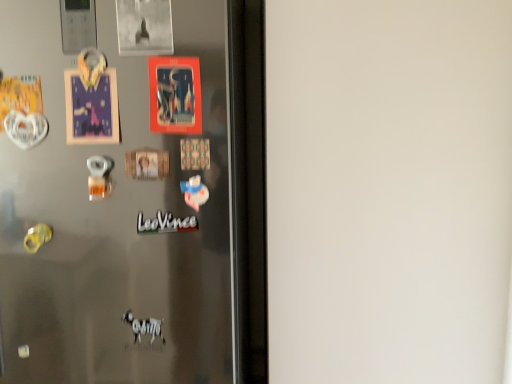
Question: Is satin metallic fridge at center facing away from white matte sticker at center?

Choices:
 (A) yes
 (B) no

Answer: (A)

Question: Is satin metallic fridge at center taller than white matte sticker at center?

Choices:
 (A) no
 (B) yes

Answer: (B)

Question: Can you confirm if satin metallic fridge at center is bigger than white matte sticker at center?

Choices:
 (A) yes
 (B) no

Answer: (A)

Question: Are satin metallic fridge at center and white matte sticker at center beside each other?

Choices:
 (A) yes
 (B) no

Answer: (B)

Question: Is satin metallic fridge at center not near white matte sticker at center?

Choices:
 (A) no
 (B) yes

Answer: (B)

Question: Is satin metallic fridge at center smaller than white matte sticker at center?

Choices:
 (A) no
 (B) yes

Answer: (A)

Question: Is matte plastic postcard at center looking in the opposite direction of white matte sticker at center?

Choices:
 (A) no
 (B) yes

Answer: (A)

Question: Can you confirm if matte plastic postcard at center is wider than white matte sticker at center?

Choices:
 (A) no
 (B) yes

Answer: (B)

Question: Can you confirm if matte plastic postcard at center is bigger than white matte sticker at center?

Choices:
 (A) yes
 (B) no

Answer: (A)

Question: From the image's perspective, is matte plastic postcard at center below white matte sticker at center?

Choices:
 (A) yes
 (B) no

Answer: (B)

Question: From the image's perspective, would you say matte plastic postcard at center is positioned over white matte sticker at center?

Choices:
 (A) no
 (B) yes

Answer: (B)

Question: Is matte plastic postcard at center thinner than white matte sticker at center?

Choices:
 (A) yes
 (B) no

Answer: (B)

Question: Can we say white matte sticker at center lies outside satin metallic fridge at center?

Choices:
 (A) yes
 (B) no

Answer: (B)